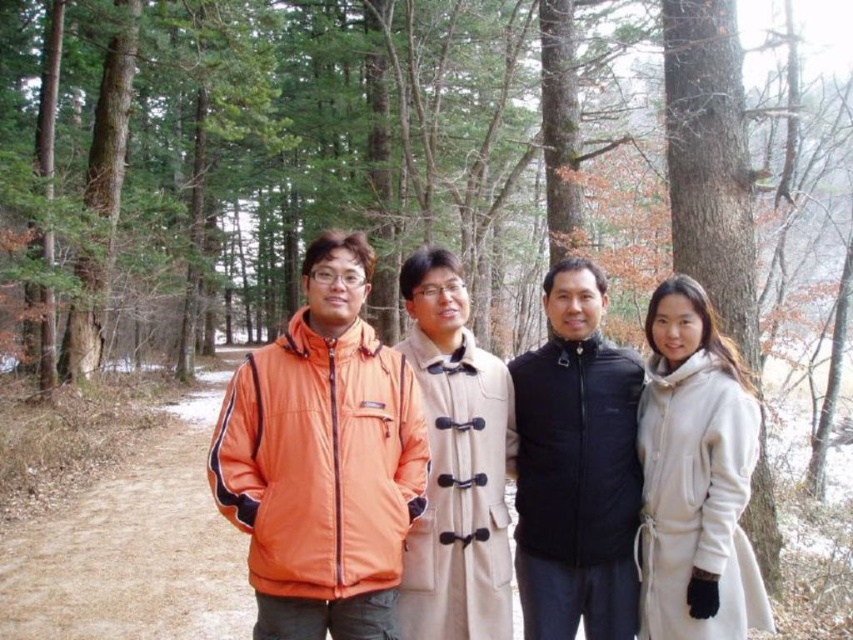
Based on the photo, you are a photographer trying to capture a group photo of the black quilted vest at center and the beige wool coat at right. Which person should you focus on first if you want to ensure both are in focus without adjusting your camera settings?

You should focus on the black quilted vest at center first because it is closer to you than the beige wool coat at right, so focusing on it will ensure the beige wool coat at right is also in focus if they are within the same focal range.

You are a photographer trying to capture a group photo of the four people in the forest. You want to ensure that the orange fabric jacket at center is positioned exactly at the center of the image. Given its current coordinates at point 0.717, 0.380, do you need to adjust the framing to center it?

The orange fabric jacket at center is already positioned at point [323,458]. Since the center of the image is typically at coordinates [426,320], this means the jacket is slightly to the right and above the true center. To center it, you would need to adjust the framing to move the camera slightly to the left and down.

You are organizing a winter clothing sale and need to arrange items by size. You have a black quilted vest at center and a beige wool coat at right. Which item should be placed in the small size section?

The black quilted vest at center should be placed in the small size section because it has a smaller size compared to the beige wool coat at right.